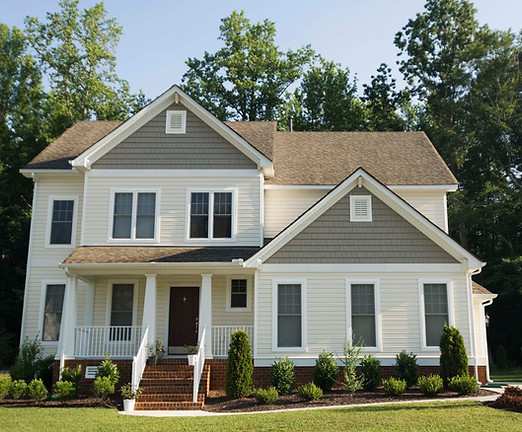
Identify the location of stairs. (155, 404), (151, 398), (150, 391), (151, 381), (151, 376), (158, 367), (165, 358).